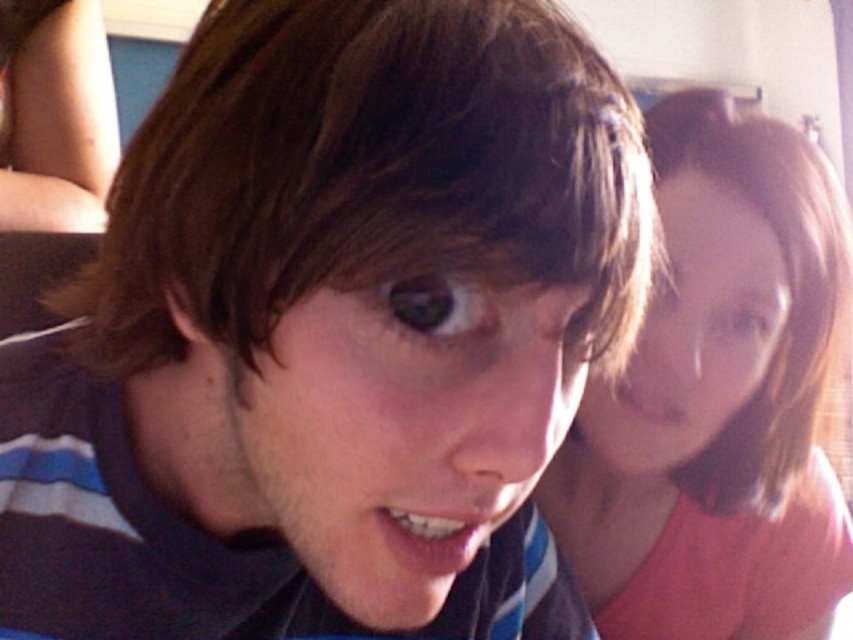
Question: Is the position of pink matte shirt at upper right less distant than that of matte black shirt at upper left?

Choices:
 (A) no
 (B) yes

Answer: (B)

Question: Is pink matte shirt at upper right to the left of matte black shirt at upper left from the viewer's perspective?

Choices:
 (A) no
 (B) yes

Answer: (A)

Question: Can you confirm if pink matte shirt at upper right is thinner than matte black shirt at upper left?

Choices:
 (A) yes
 (B) no

Answer: (B)

Question: Among these objects, which one is farthest from the camera?

Choices:
 (A) matte black shirt at upper left
 (B) pink matte shirt at upper right

Answer: (A)

Question: Which object appears farthest from the camera in this image?

Choices:
 (A) matte black shirt at upper left
 (B) pink matte shirt at upper right

Answer: (A)